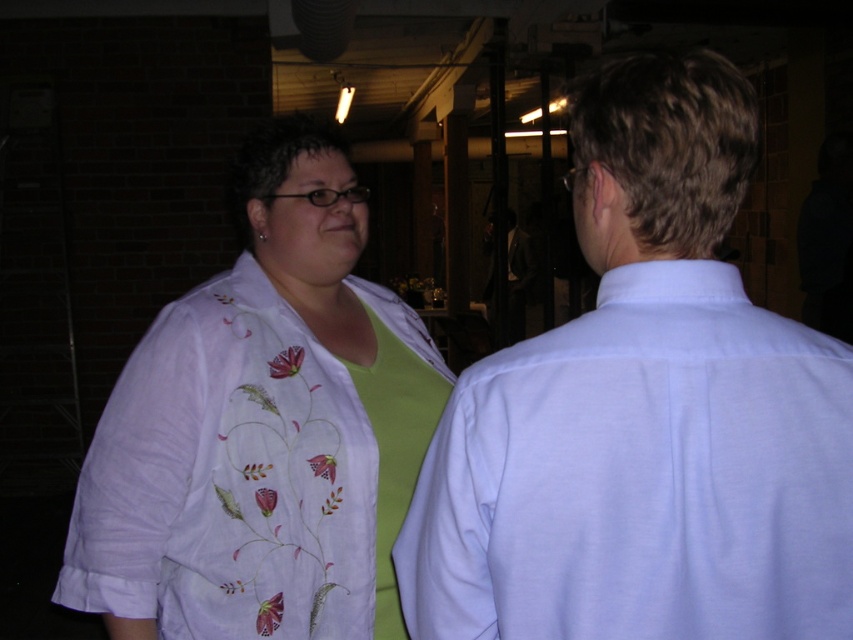
Is point (637, 445) less distant than point (276, 628)?

That is True.

Measure the distance between point (669,483) and camera.

Point (669,483) is 31.38 inches away from camera.

Who is more distant from viewer, (701, 268) or (173, 616)?

Point (173, 616)

You are a GUI agent. You are given a task and a screenshot of the screen. Output one action in this format:
    pyautogui.click(x=<x>, y=<y>)
    Task: Click on the white smooth shirt at center
    The width and height of the screenshot is (853, 640).
    Given the screenshot: What is the action you would take?
    pyautogui.click(x=643, y=412)